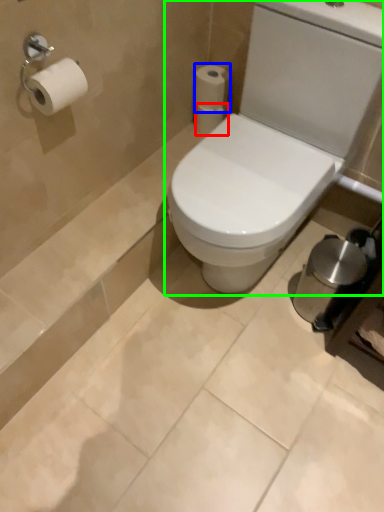
Question: Which is nearer to the toilet paper (highlighted by a red box)? toilet paper (highlighted by a blue box) or toilet (highlighted by a green box).

Choices:
 (A) toilet paper
 (B) toilet

Answer: (A)